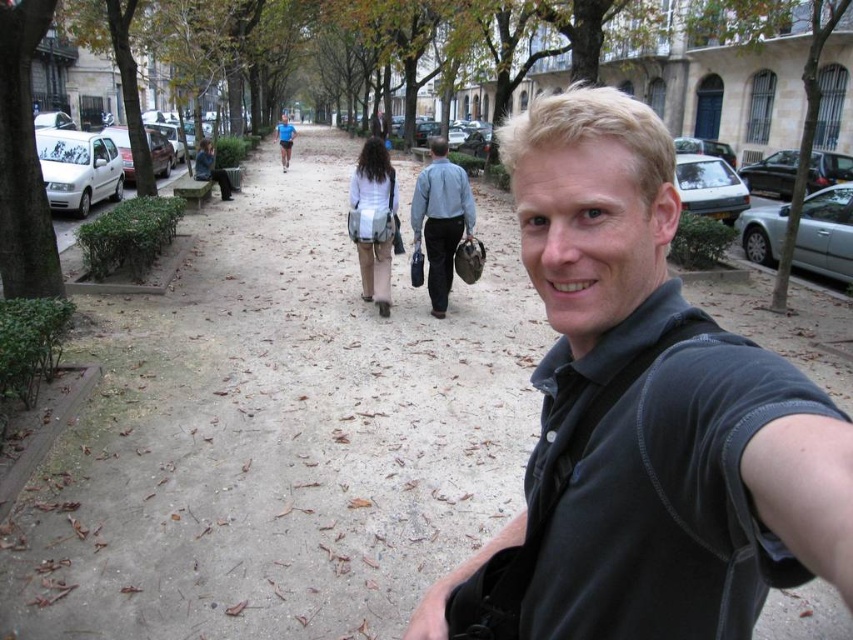
Does black matte shirt at center come behind blue shirt at center?

No.

Find the location of `black matte shirt at center`. black matte shirt at center is located at coordinates (643, 419).

Who is more distant from viewer, (630,145) or (283,163)?

The point (283,163) is more distant.

Image resolution: width=853 pixels, height=640 pixels. Find the location of `black matte shirt at center`. black matte shirt at center is located at coordinates (643, 419).

Does black matte shirt at center have a smaller size compared to light blue shirt at center?

Yes.

Between black matte shirt at center and light blue shirt at center, which one is positioned lower?

black matte shirt at center

Between point (804, 550) and point (442, 182), which one is positioned in front?

Positioned in front is point (804, 550).

Where is `black matte shirt at center`? Image resolution: width=853 pixels, height=640 pixels. black matte shirt at center is located at coordinates pyautogui.click(x=643, y=419).

Between light blue shirt at center and blue shirt at center, which one has more height?

blue shirt at center is taller.

Consider the image. Does light blue shirt at center appear over blue shirt at center?

No, light blue shirt at center is not above blue shirt at center.

Where is `light blue shirt at center`? light blue shirt at center is located at coordinates (440, 220).

Locate an element on the screen. The image size is (853, 640). light blue shirt at center is located at coordinates (440, 220).